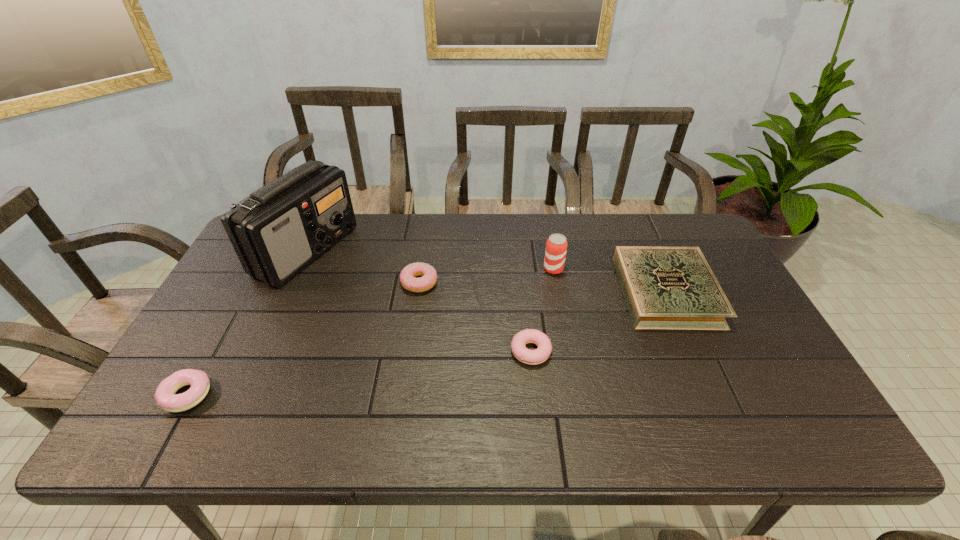
Identify which object is the nearest to the leftmost doughnut. Please provide its 2D coordinates. Your answer should be formatted as a tuple, i.e. [(x, y)], where the tuple contains the x and y coordinates of a point satisfying the conditions above.

[(277, 231)]

At what (x,y) coordinates should I click in order to perform the action: click on doughnut that can be found as the second closest to the farthest doughnut. Please return your answer as a coordinate pair (x, y). This screenshot has width=960, height=540. Looking at the image, I should click on (165, 396).

I want to click on the second closest doughnut to the second nearest object, so (x=165, y=396).

Where is `vacant point that satisfies the following two spatial constraints: 1. on the front panel of the radio receiver; 2. on the left side of the second doughnut from right to left`? The width and height of the screenshot is (960, 540). vacant point that satisfies the following two spatial constraints: 1. on the front panel of the radio receiver; 2. on the left side of the second doughnut from right to left is located at coordinates (292, 282).

Locate an element on the screen. This screenshot has height=540, width=960. vacant area in the image that satisfies the following two spatial constraints: 1. on the front panel of the tallest object; 2. on the right side of the second tallest object is located at coordinates (298, 269).

You are a GUI agent. You are given a task and a screenshot of the screen. Output one action in this format:
    pyautogui.click(x=<x>, y=<y>)
    Task: Click on the vacant space that satisfies the following two spatial constraints: 1. on the back side of the fifth shortest object; 2. on the left side of the farthest doughnut
    Image resolution: width=960 pixels, height=540 pixels.
    Given the screenshot: What is the action you would take?
    pyautogui.click(x=421, y=269)

This screenshot has width=960, height=540. In order to click on free location that satisfies the following two spatial constraints: 1. on the front panel of the second doughnut from left to right; 2. on the right side of the radio receiver in this screenshot , I will do `click(292, 282)`.

Where is `vacant space that satisfies the following two spatial constraints: 1. on the back side of the beer can; 2. on the right side of the second doughnut from right to left`? vacant space that satisfies the following two spatial constraints: 1. on the back side of the beer can; 2. on the right side of the second doughnut from right to left is located at coordinates (421, 269).

You are a GUI agent. You are given a task and a screenshot of the screen. Output one action in this format:
    pyautogui.click(x=<x>, y=<y>)
    Task: Click on the free point that satisfies the following two spatial constraints: 1. on the back side of the leftmost doughnut; 2. on the right side of the hardback book
    
    Given the screenshot: What is the action you would take?
    pos(245,292)